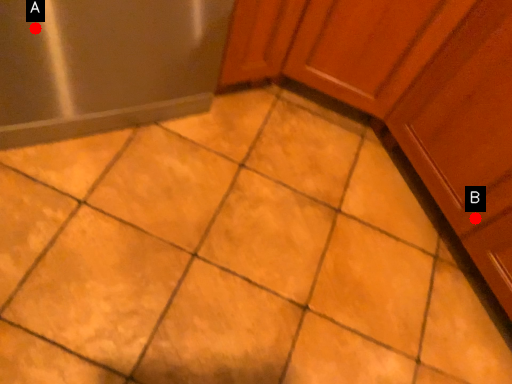
Question: Two points are circled on the image, labeled by A and B beside each circle. Which point is closer to the camera?

Choices:
 (A) A is closer
 (B) B is closer

Answer: (A)